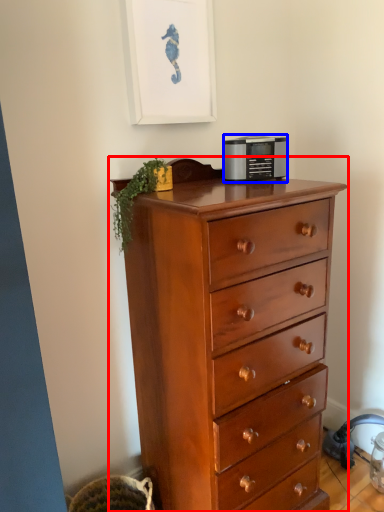
Question: Among these objects, which one is nearest to the camera, chest of drawers (highlighted by a red box) or appliance (highlighted by a blue box)?

Choices:
 (A) chest of drawers
 (B) appliance

Answer: (A)